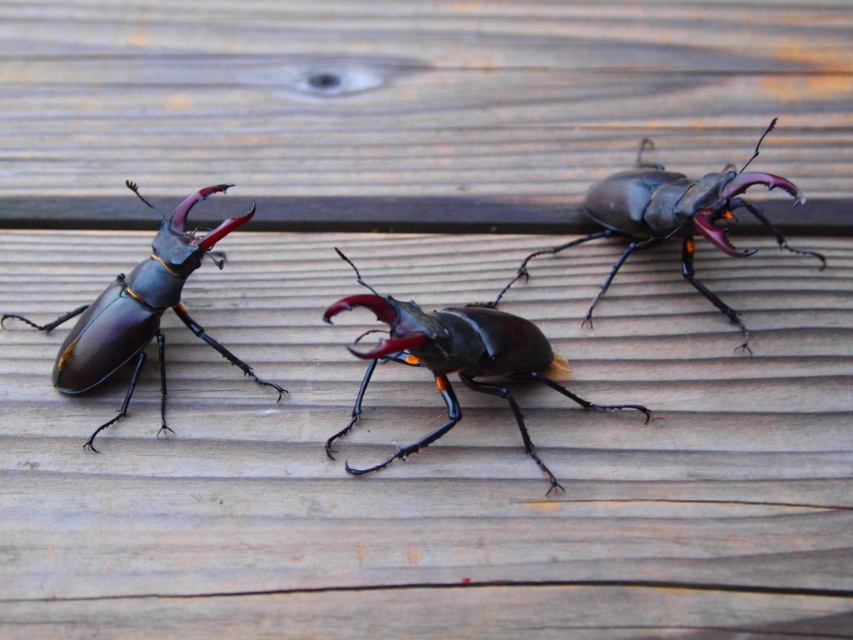
Which of these two, shiny dark brown beetle at center or glossy black beetle at left, stands shorter?

shiny dark brown beetle at center

Consider the image. Does shiny dark brown beetle at center have a smaller size compared to glossy black beetle at left?

No, shiny dark brown beetle at center is not smaller than glossy black beetle at left.

Where is `shiny dark brown beetle at center`? The width and height of the screenshot is (853, 640). shiny dark brown beetle at center is located at coordinates (457, 358).

Does glossy black beetle at left lie behind shiny brown beetle at center?

Yes.

Can you confirm if glossy black beetle at left is taller than shiny brown beetle at center?

No.

In order to click on glossy black beetle at left in this screenshot , I will do `click(138, 310)`.

Based on the photo, is shiny dark brown beetle at center positioned behind shiny brown beetle at center?

No, it is in front of shiny brown beetle at center.

Does point (434, 371) come behind point (657, 227)?

No, (434, 371) is in front of (657, 227).

You are a GUI agent. You are given a task and a screenshot of the screen. Output one action in this format:
    pyautogui.click(x=<x>, y=<y>)
    Task: Click on the shiny dark brown beetle at center
    
    Given the screenshot: What is the action you would take?
    pyautogui.click(x=457, y=358)